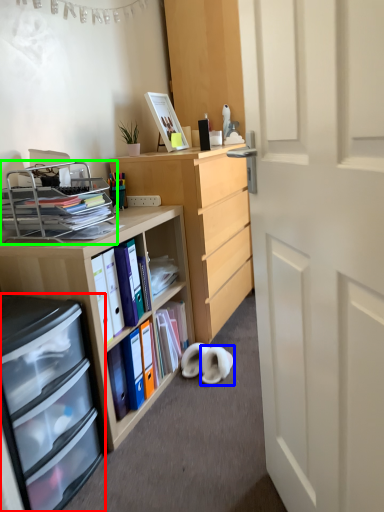
Question: Based on their relative distances, which object is nearer to cabinetry (highlighted by a red box)? Choose from footwear (highlighted by a blue box) and shelf (highlighted by a green box).

Choices:
 (A) footwear
 (B) shelf

Answer: (B)